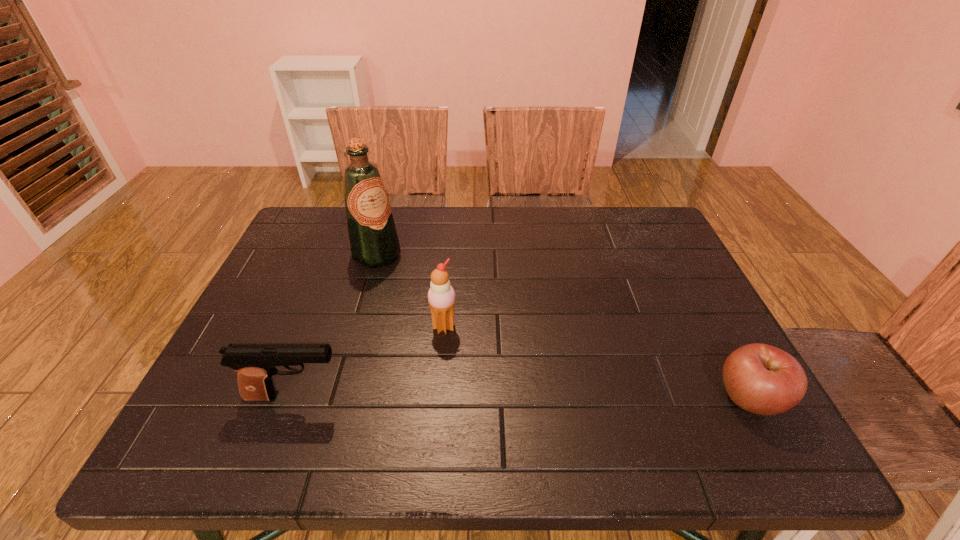
The height and width of the screenshot is (540, 960). I want to click on vacant space located at the front with a straw on the second object from right to left, so coord(495,379).

You are a GUI agent. You are given a task and a screenshot of the screen. Output one action in this format:
    pyautogui.click(x=<x>, y=<y>)
    Task: Click on the vacant space located 0.150m on the front-facing side of the tallest object
    Image resolution: width=960 pixels, height=540 pixels.
    Given the screenshot: What is the action you would take?
    pyautogui.click(x=420, y=296)

I want to click on vacant space situated on the front-facing side of the tallest object, so click(x=477, y=353).

At what (x,y) coordinates should I click in order to perform the action: click on free space located 0.100m on the front-facing side of the tallest object. Please return your answer as a coordinate pair (x, y). The height and width of the screenshot is (540, 960). Looking at the image, I should click on (409, 286).

Identify the location of object at the far edge. (374, 242).

In order to click on pistol at the near edge in this screenshot , I will do `click(255, 363)`.

The width and height of the screenshot is (960, 540). I want to click on apple present at the near edge, so click(x=762, y=379).

In order to click on object located in the left edge section of the desktop in this screenshot , I will do `click(255, 363)`.

You are a GUI agent. You are given a task and a screenshot of the screen. Output one action in this format:
    pyautogui.click(x=<x>, y=<y>)
    Task: Click on the object positioned at the right edge
    The image size is (960, 540).
    Given the screenshot: What is the action you would take?
    pyautogui.click(x=762, y=379)

The height and width of the screenshot is (540, 960). I want to click on object present at the near left corner, so click(255, 363).